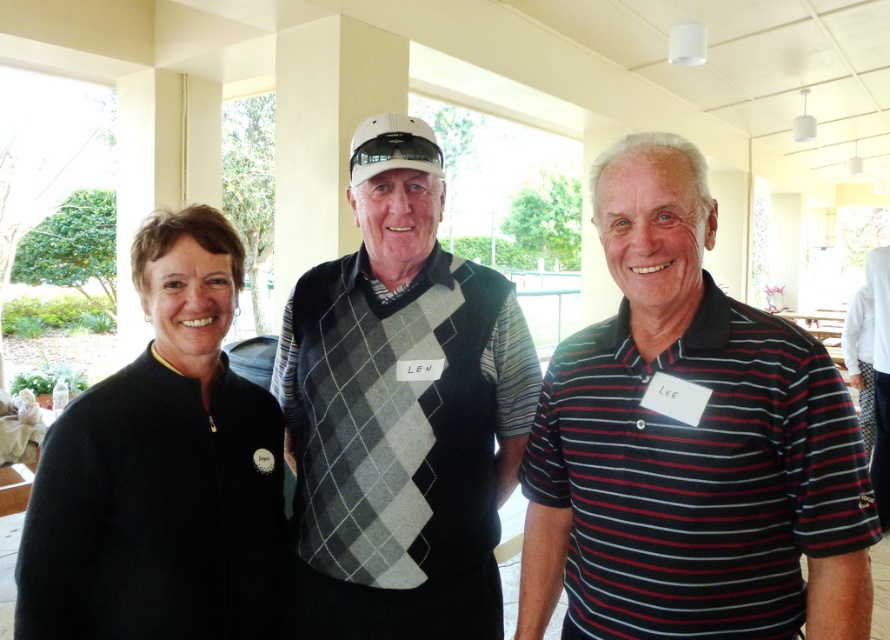
Between point (359, 371) and point (136, 403), which one is positioned behind?

The point (359, 371) is more distant.

Is argyle sweater vest at center bigger than black matte jacket at left?

Indeed, argyle sweater vest at center has a larger size compared to black matte jacket at left.

You are a GUI agent. You are given a task and a screenshot of the screen. Output one action in this format:
    pyautogui.click(x=<x>, y=<y>)
    Task: Click on the argyle sweater vest at center
    The height and width of the screenshot is (640, 890).
    Given the screenshot: What is the action you would take?
    pyautogui.click(x=400, y=412)

Who is more distant from viewer, (603, 464) or (55, 564)?

Point (55, 564)

Can you confirm if striped cotton polo shirt at right is positioned to the left of black matte jacket at left?

No, striped cotton polo shirt at right is not to the left of black matte jacket at left.

Which is in front, point (761, 364) or point (241, 429)?

Point (761, 364) is more forward.

Locate an element on the screen. This screenshot has height=640, width=890. striped cotton polo shirt at right is located at coordinates (689, 444).

Where is `striped cotton polo shirt at right`? The width and height of the screenshot is (890, 640). striped cotton polo shirt at right is located at coordinates (689, 444).

Is point (648, 296) closer to viewer compared to point (457, 296)?

Yes.

This screenshot has height=640, width=890. I want to click on striped cotton polo shirt at right, so click(x=689, y=444).